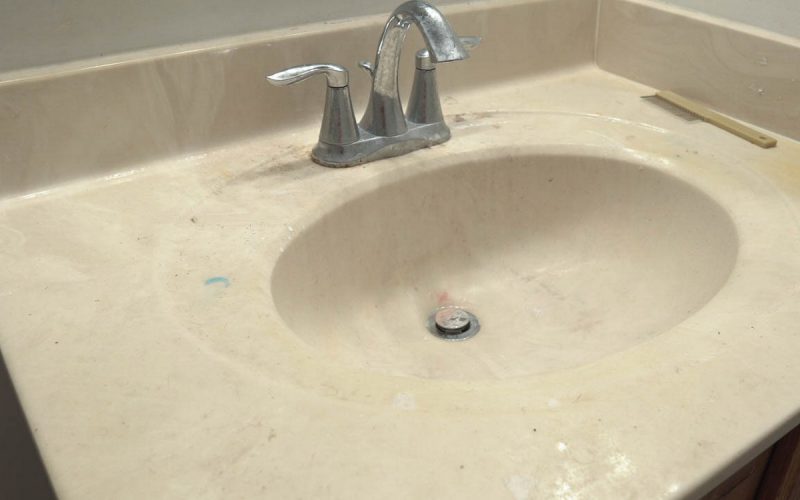
This screenshot has width=800, height=500. Find the location of `wall`. wall is located at coordinates (182, 112), (702, 63).